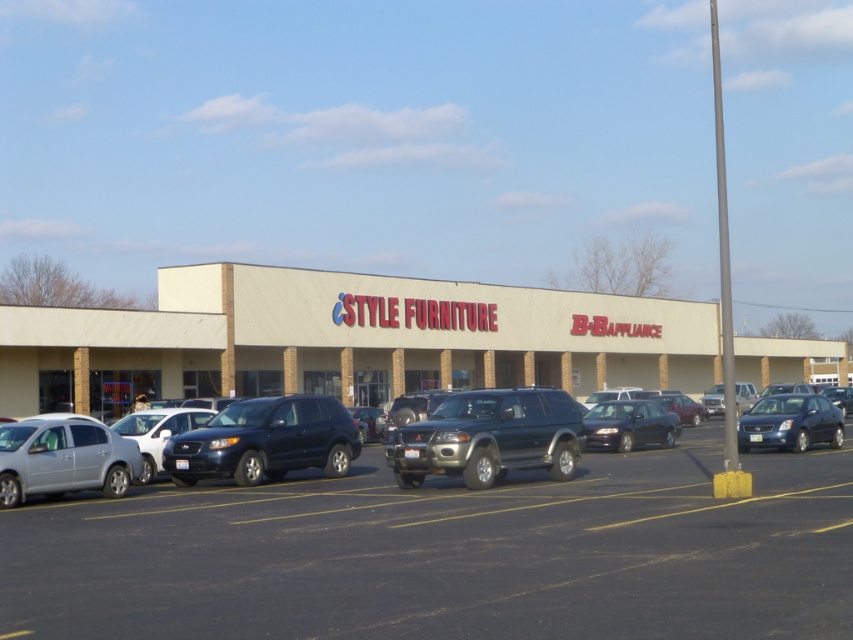
Is silver metallic suv at center wider than shiny dark blue suv at center?

Yes, silver metallic suv at center is wider than shiny dark blue suv at center.

Between point (492, 452) and point (279, 420), which one is positioned behind?

Positioned behind is point (279, 420).

The height and width of the screenshot is (640, 853). What are the coordinates of `silver metallic suv at center` in the screenshot? It's located at pyautogui.click(x=503, y=435).

Is point (517, 362) positioned after point (498, 422)?

That is True.

Between beige/concrete mall at center and silver metallic suv at center, which one appears on the right side from the viewer's perspective?

beige/concrete mall at center

Is point (160, 276) in front of point (262, 454)?

No, it is not.

Find the location of `beige/concrete mall at center`. beige/concrete mall at center is located at coordinates (344, 340).

In the scene shown: How much distance is there between dark gray asphalt parking lot at center and beige/concrete mall at center?

The distance of dark gray asphalt parking lot at center from beige/concrete mall at center is 27.76 meters.

Does dark gray asphalt parking lot at center appear over beige/concrete mall at center?

No, dark gray asphalt parking lot at center is not above beige/concrete mall at center.

Measure the distance between dark gray asphalt parking lot at center and camera.

The distance of dark gray asphalt parking lot at center from camera is 8.40 meters.

Locate an element on the screen. dark gray asphalt parking lot at center is located at coordinates (448, 554).